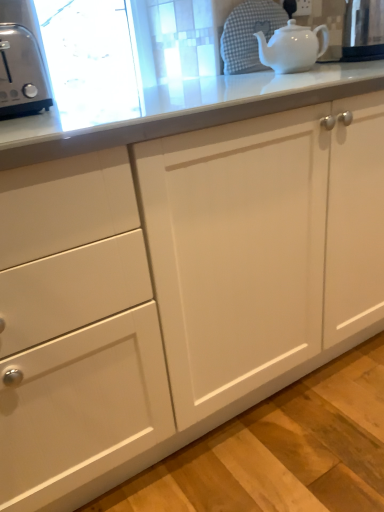
Question: Considering the relative sizes of satin silver toaster at left and white glossy teapot at upper right in the image provided, is satin silver toaster at left shorter than white glossy teapot at upper right?

Choices:
 (A) no
 (B) yes

Answer: (A)

Question: From the image's perspective, is satin silver toaster at left beneath white glossy teapot at upper right?

Choices:
 (A) yes
 (B) no

Answer: (A)

Question: Considering the relative positions of satin silver toaster at left and white glossy teapot at upper right in the image provided, is satin silver toaster at left to the left of white glossy teapot at upper right from the viewer's perspective?

Choices:
 (A) yes
 (B) no

Answer: (A)

Question: Is satin silver toaster at left taller than white glossy teapot at upper right?

Choices:
 (A) yes
 (B) no

Answer: (A)

Question: Is the position of satin silver toaster at left more distant than that of white glossy teapot at upper right?

Choices:
 (A) no
 (B) yes

Answer: (A)

Question: Looking at the image, does metallic stainless steel kettle at upper right seem bigger or smaller compared to satin silver toaster at left?

Choices:
 (A) big
 (B) small

Answer: (B)

Question: Do you think metallic stainless steel kettle at upper right is within satin silver toaster at left, or outside of it?

Choices:
 (A) inside
 (B) outside

Answer: (B)

Question: From a real-world perspective, is metallic stainless steel kettle at upper right physically located above or below satin silver toaster at left?

Choices:
 (A) above
 (B) below

Answer: (A)

Question: Is metallic stainless steel kettle at upper right taller or shorter than satin silver toaster at left?

Choices:
 (A) tall
 (B) short

Answer: (A)

Question: Based on their sizes in the image, would you say metallic stainless steel kettle at upper right is bigger or smaller than white glossy teapot at upper right?

Choices:
 (A) big
 (B) small

Answer: (A)

Question: From a real-world perspective, is metallic stainless steel kettle at upper right positioned above or below white glossy teapot at upper right?

Choices:
 (A) below
 (B) above

Answer: (B)

Question: In terms of height, does metallic stainless steel kettle at upper right look taller or shorter compared to white glossy teapot at upper right?

Choices:
 (A) short
 (B) tall

Answer: (B)

Question: Relative to white glossy teapot at upper right, is metallic stainless steel kettle at upper right in front or behind?

Choices:
 (A) front
 (B) behind

Answer: (B)

Question: Considering the positions of white glossy teapot at upper right and metallic stainless steel kettle at upper right in the image, is white glossy teapot at upper right bigger or smaller than metallic stainless steel kettle at upper right?

Choices:
 (A) small
 (B) big

Answer: (A)

Question: Is white glossy teapot at upper right wider or thinner than metallic stainless steel kettle at upper right?

Choices:
 (A) wide
 (B) thin

Answer: (A)